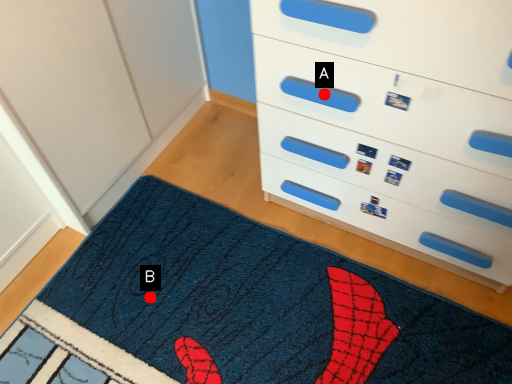
Question: Two points are circled on the image, labeled by A and B beside each circle. Which point is further to the camera?

Choices:
 (A) A is further
 (B) B is further

Answer: (B)